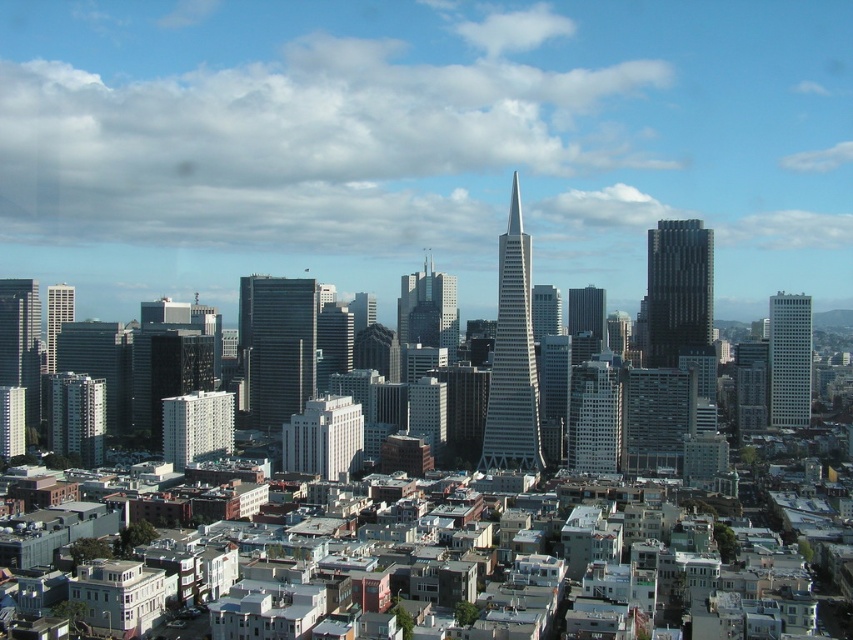
Question: Which of the following is the closest to the observer?

Choices:
 (A) (685, 296)
 (B) (581, 314)
 (C) (521, 259)

Answer: (C)

Question: Can you confirm if dark gray glass skyscraper at right is bigger than white glass skyscraper at right?

Choices:
 (A) yes
 (B) no

Answer: (A)

Question: Among these objects, which one is farthest from the camera?

Choices:
 (A) matte glass skyscraper at center
 (B) dark gray glass skyscraper at right

Answer: (B)

Question: Considering the real-world distances, which object is closest to the matte glass skyscraper at center-right?

Choices:
 (A) matte glass skyscraper at center
 (B) matte glass skyscraper at left
 (C) dark glass skyscraper at center
 (D) white glass skyscraper at right

Answer: (A)

Question: Is dark gray glass skyscraper at right further to camera compared to matte glass skyscraper at center?

Choices:
 (A) no
 (B) yes

Answer: (B)

Question: Is dark glass skyscraper at center smaller than matte glass skyscraper at center-right?

Choices:
 (A) yes
 (B) no

Answer: (B)